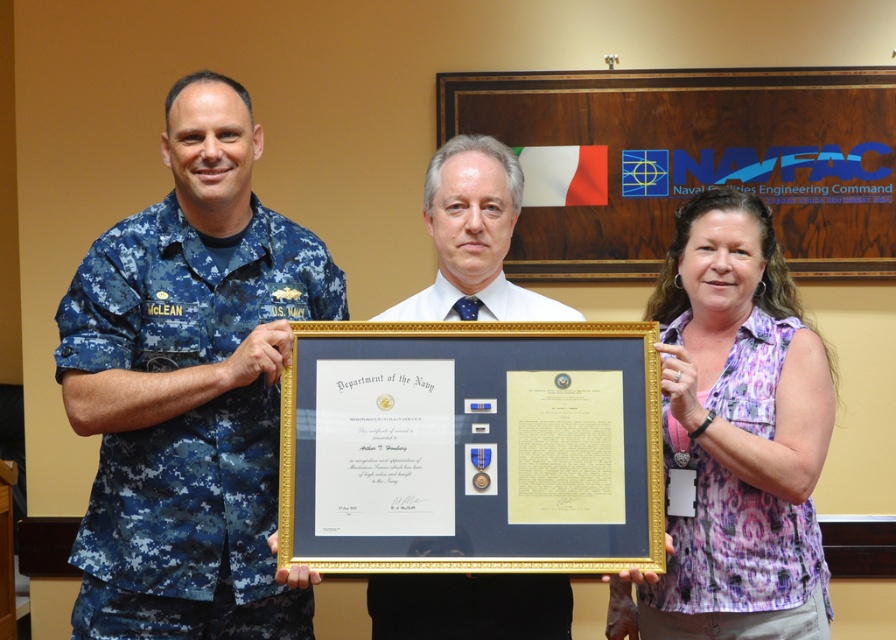
Question: Among these objects, which one is nearest to the camera?

Choices:
 (A) digital camouflage uniform at left
 (B) white matte framed certificate at center
 (C) blue fabric uniform at center

Answer: (A)

Question: Among these points, which one is nearest to the camera?

Choices:
 (A) (100, 557)
 (B) (685, 368)
 (C) (546, 300)
 (D) (429, 582)

Answer: (B)

Question: Which of the following is the farthest from the observer?

Choices:
 (A) digital camouflage uniform at left
 (B) blue fabric uniform at center

Answer: (B)

Question: Is purple printed shirt at center positioned at the back of blue fabric uniform at center?

Choices:
 (A) no
 (B) yes

Answer: (A)

Question: Does purple printed shirt at center appear on the left side of white matte framed certificate at center?

Choices:
 (A) yes
 (B) no

Answer: (B)

Question: Is digital camouflage uniform at left smaller than blue fabric uniform at center?

Choices:
 (A) no
 (B) yes

Answer: (A)